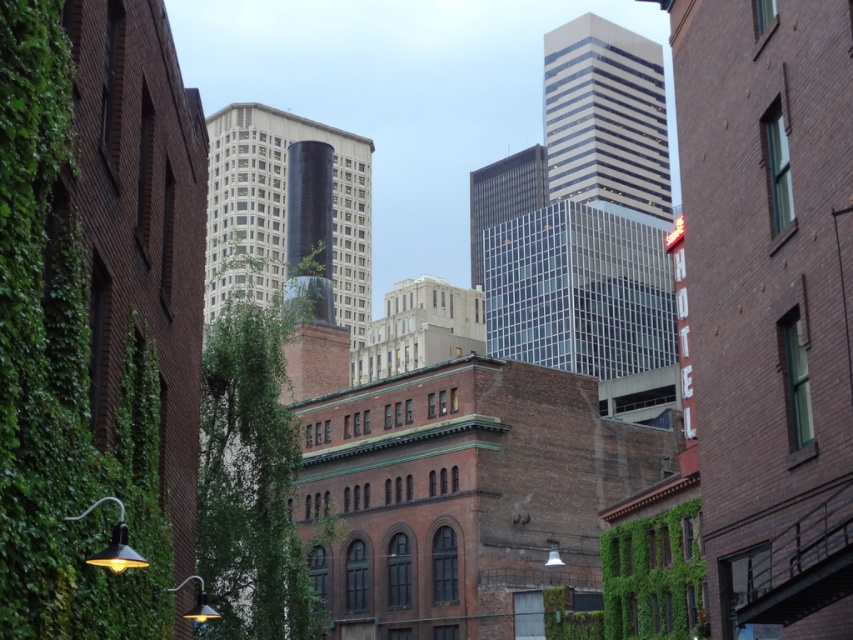
You are a city planner assessing greenery coverage in an urban area. You observe the green ivy at left and the green leafy ivy at center. Which ivy has a greater height?

The green leafy ivy at center has a greater height than the green ivy at left.

You are a painter standing in front of the urban scene described. You want to paint the green ivy at left and the green leafy ivy at center. Which one will appear closer to you in your painting?

The green ivy at left will appear closer to you in your painting because it is positioned in front of the green leafy ivy at center.